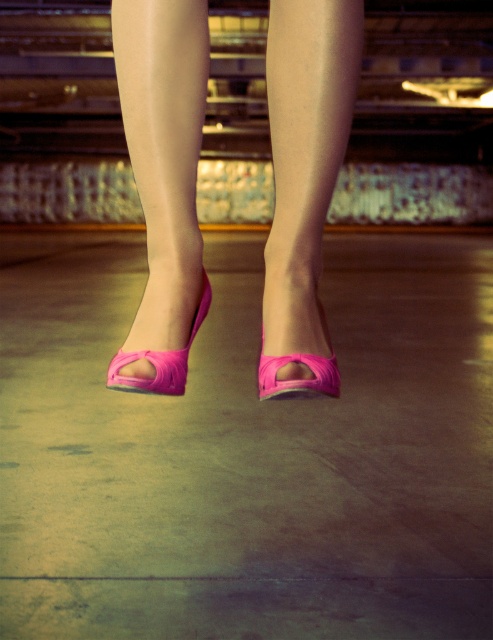
Is neon pink satin heels at center bigger than matte pink high-heeled shoe at center?

A: No.

Does neon pink satin heels at center appear over matte pink high-heeled shoe at center?

Yes.

Is point (194, 118) in front of point (347, 44)?

No.

Where is `neon pink satin heels at center`? The image size is (493, 640). neon pink satin heels at center is located at coordinates (163, 180).

Who is taller, neon pink satin heels at center or neon pink satin sandal at lower center?

Result: neon pink satin heels at center is taller.

Is point (160, 70) less distant than point (186, 371)?

Yes, point (160, 70) is closer to viewer.

Between point (179, 384) and point (203, 280), which one is positioned in front?

Point (179, 384)

Where is `neon pink satin heels at center`? The width and height of the screenshot is (493, 640). neon pink satin heels at center is located at coordinates (163, 180).

Who is shorter, matte pink high-heeled shoe at center or neon pink satin high-heeled shoe at center?

neon pink satin high-heeled shoe at center is shorter.

How much distance is there between matte pink high-heeled shoe at center and neon pink satin high-heeled shoe at center?

matte pink high-heeled shoe at center is 5.89 inches from neon pink satin high-heeled shoe at center.

At what (x,y) coordinates should I click in order to perform the action: click on matte pink high-heeled shoe at center. Please return your answer as a coordinate pair (x, y). The image size is (493, 640). Looking at the image, I should click on (305, 177).